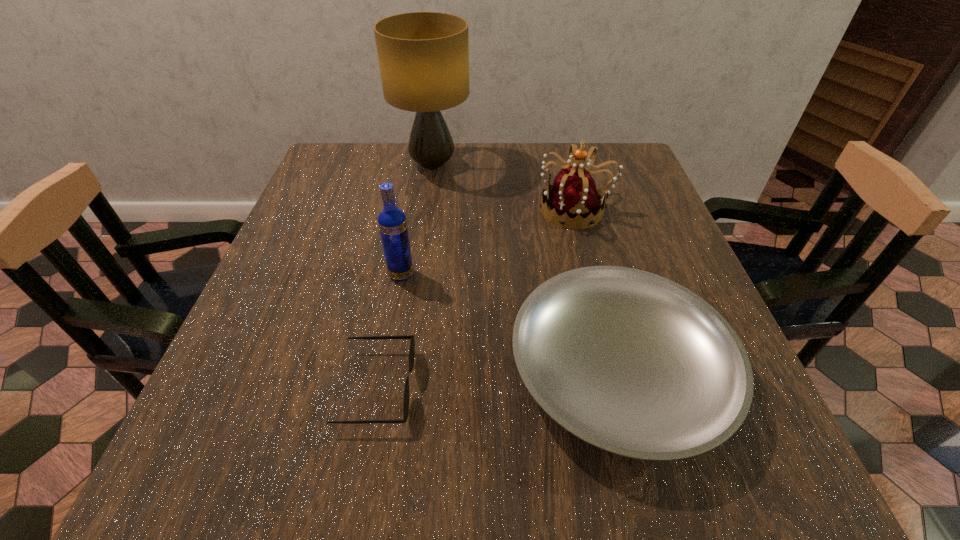
The height and width of the screenshot is (540, 960). What are the coordinates of `vacant space situated 0.300m on the front-facing side of the tiara` in the screenshot? It's located at (414, 210).

Identify the location of free space located on the front-facing side of the tiara. (381, 210).

Find the location of a particular element. vacant space situated on the left of the bedpan is located at coordinates (334, 371).

The width and height of the screenshot is (960, 540). What are the coordinates of `vacant space located 0.090m on the front-facing side of the sunglasses` in the screenshot? It's located at (468, 387).

Identify the location of lampshade located in the far edge section of the desktop. (423, 57).

The image size is (960, 540). Identify the location of tiara present at the far edge. (574, 199).

The image size is (960, 540). Find the location of `object that is at the near edge`. object that is at the near edge is located at coordinates (633, 363).

The image size is (960, 540). Find the location of `tiara that is at the right edge`. tiara that is at the right edge is located at coordinates (574, 199).

Identify the location of bedpan situated at the right edge. (633, 363).

Where is `object present at the far right corner`? object present at the far right corner is located at coordinates (574, 199).